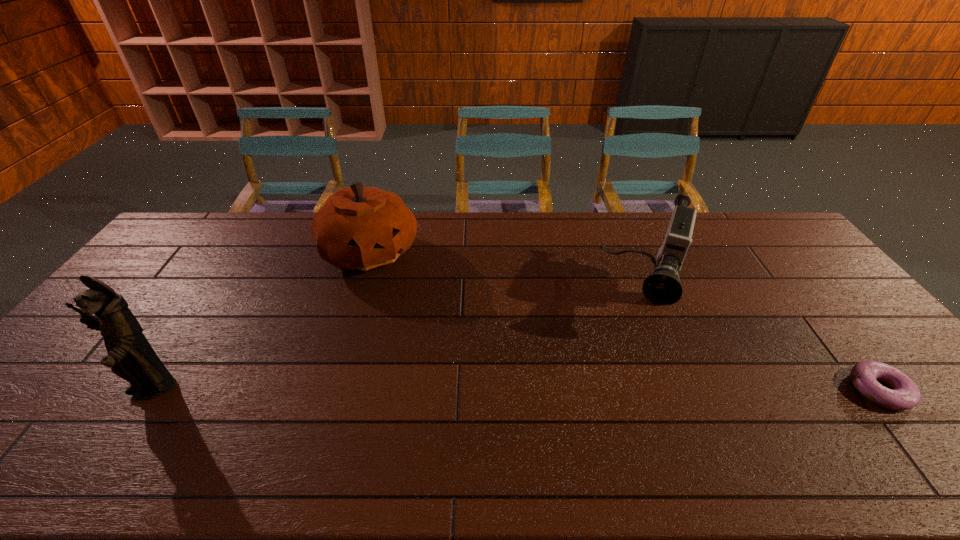
This screenshot has height=540, width=960. Identify the location of figurine. (130, 356).

At what (x,y) coordinates should I click in order to perform the action: click on the tallest object. Please return your answer as a coordinate pair (x, y). Looking at the image, I should click on (130, 356).

Locate an element on the screen. The height and width of the screenshot is (540, 960). doughnut is located at coordinates (904, 394).

You are a GUI agent. You are given a task and a screenshot of the screen. Output one action in this format:
    pyautogui.click(x=<x>, y=<y>)
    Task: Click on the rightmost object
    
    Given the screenshot: What is the action you would take?
    pyautogui.click(x=904, y=394)

Identify the location of pumpkin. This screenshot has width=960, height=540. (361, 228).

At what (x,y) coordinates should I click in order to perform the action: click on camcorder. Please return your answer as a coordinate pair (x, y). This screenshot has height=540, width=960. Looking at the image, I should click on (662, 287).

Locate an element on the screen. This screenshot has height=540, width=960. vacant space situated on the back of the doughnut is located at coordinates (790, 279).

Where is `free spot located 0.200m on the front-facing side of the third object from right to left`? free spot located 0.200m on the front-facing side of the third object from right to left is located at coordinates (441, 305).

Locate an element on the screen. The image size is (960, 540). blank space located 0.350m on the front-facing side of the third object from right to left is located at coordinates (475, 332).

The height and width of the screenshot is (540, 960). Find the location of `free location located on the front-facing side of the third object from right to left`. free location located on the front-facing side of the third object from right to left is located at coordinates (441, 305).